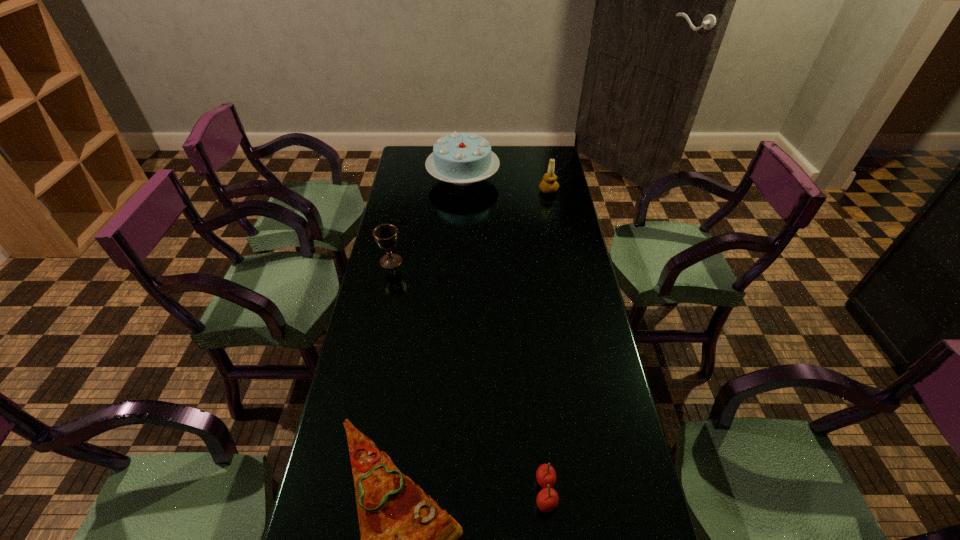
Where is `birthday cake at the left edge`? The width and height of the screenshot is (960, 540). birthday cake at the left edge is located at coordinates (461, 158).

Find the location of a particular element. The height and width of the screenshot is (540, 960). chalice that is at the left edge is located at coordinates (386, 235).

Where is `object that is at the right edge`? The image size is (960, 540). object that is at the right edge is located at coordinates (549, 185).

Identify the location of object at the far left corner. The width and height of the screenshot is (960, 540). (461, 158).

Where is `vacant point at the left edge`? This screenshot has height=540, width=960. vacant point at the left edge is located at coordinates (325, 529).

The height and width of the screenshot is (540, 960). In order to click on blank space at the right edge in this screenshot , I will do `click(555, 310)`.

Locate an element on the screen. free space at the far right corner of the desktop is located at coordinates (544, 157).

Image resolution: width=960 pixels, height=540 pixels. Find the location of `vacant area that lies between the cherry and the birthday cake`. vacant area that lies between the cherry and the birthday cake is located at coordinates (504, 335).

Identify the location of vacant space that's between the candle_holder and the third farthest object. This screenshot has width=960, height=540. (469, 226).

This screenshot has width=960, height=540. I want to click on free space that is in between the rightmost object and the tallest object, so click(x=506, y=185).